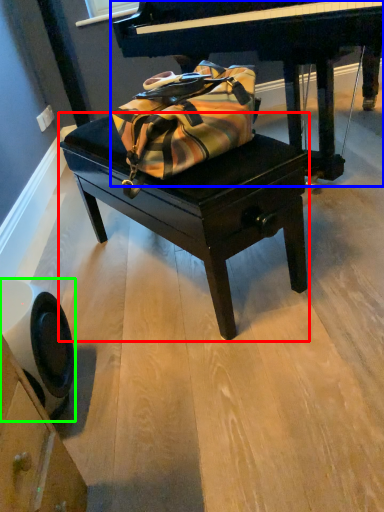
Question: Based on their relative distances, which object is nearer to table (highlighted by a red box)? Choose from piano (highlighted by a blue box) and swivel chair (highlighted by a green box).

Choices:
 (A) piano
 (B) swivel chair

Answer: (B)